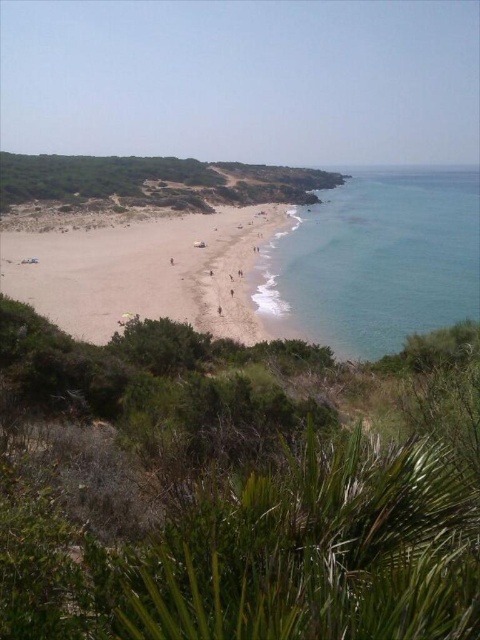
Question: Which point is farther to the camera?

Choices:
 (A) (97, 230)
 (B) (464, 298)

Answer: (A)

Question: Where is clear blue water at right located in relation to light brown sand at lower left in the image?

Choices:
 (A) below
 (B) above

Answer: (B)

Question: Is clear blue water at right wider than light brown sand at lower left?

Choices:
 (A) yes
 (B) no

Answer: (A)

Question: From the image, what is the correct spatial relationship of clear blue water at right in relation to light brown sand at lower left?

Choices:
 (A) left
 (B) right

Answer: (B)

Question: Among these points, which one is farthest from the camera?

Choices:
 (A) (192, 266)
 (B) (380, 340)

Answer: (A)

Question: Which object appears farthest from the camera in this image?

Choices:
 (A) clear blue water at right
 (B) light brown sand at lower left

Answer: (A)